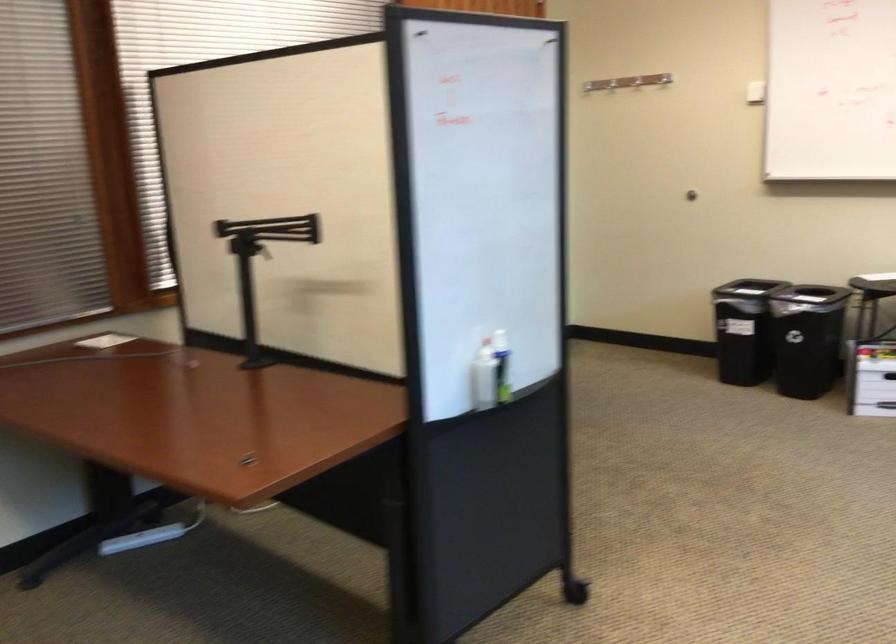
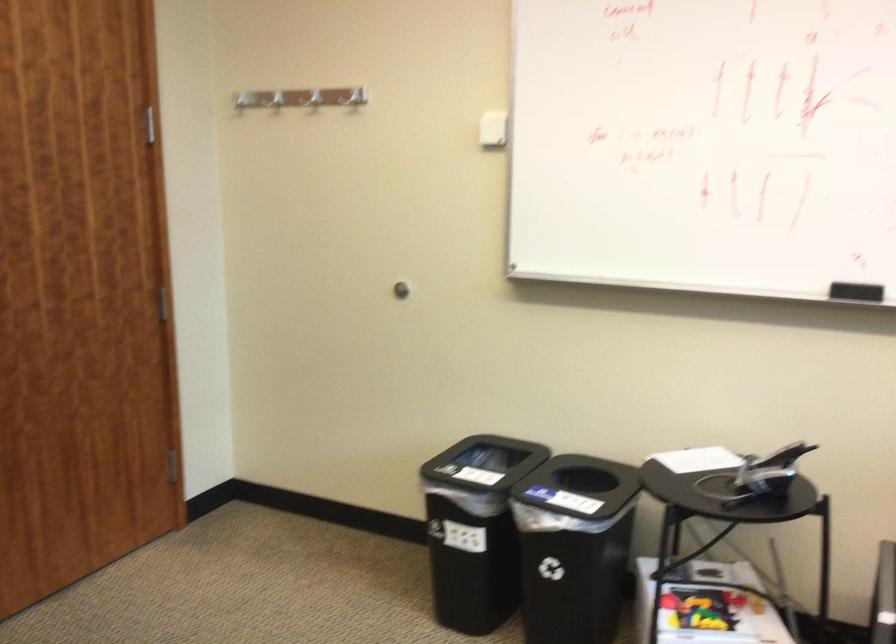
In the second image, find the point that corresponds to point 750,304 in the first image.

(574, 547)